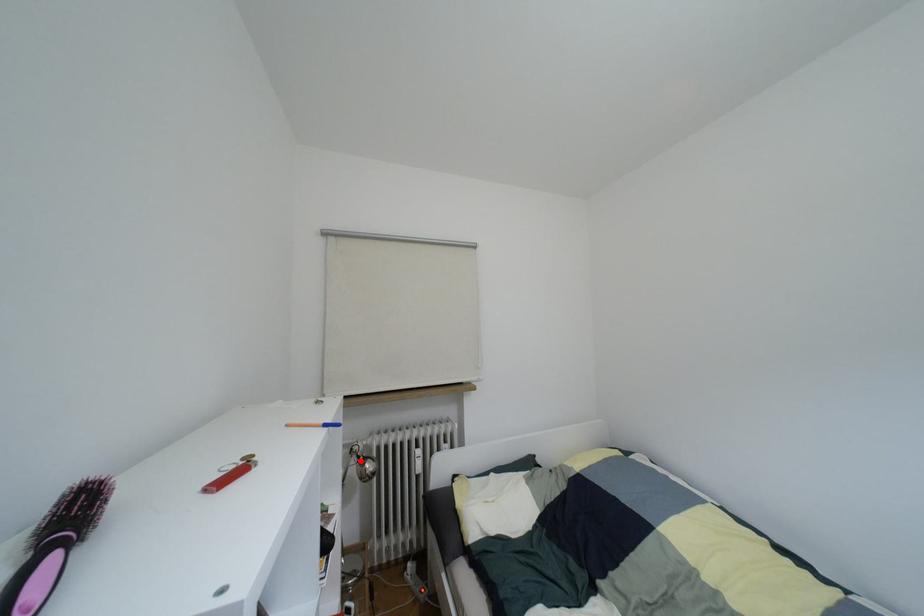
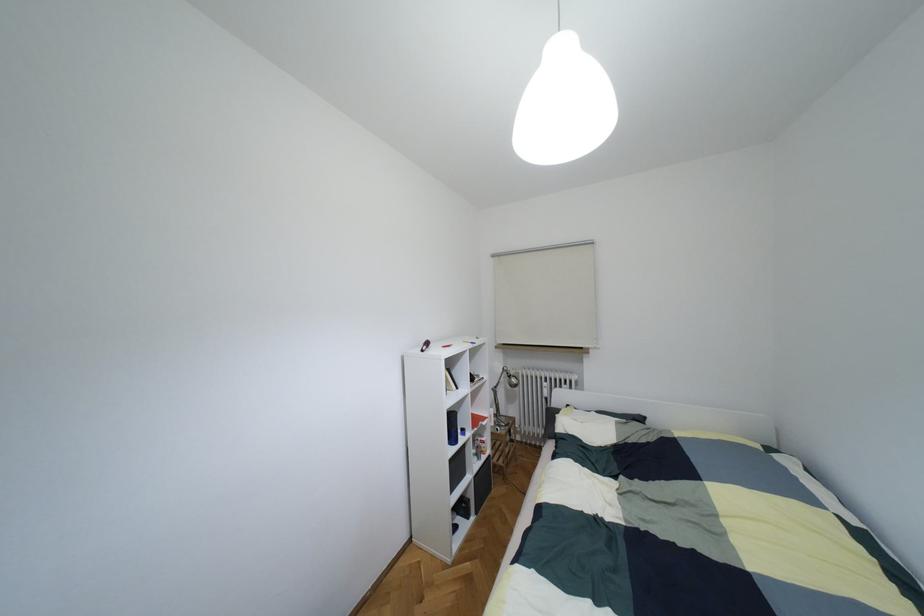
The point at the highlighted location is marked in the first image. Where is the corresponding point in the second image?

(508, 376)